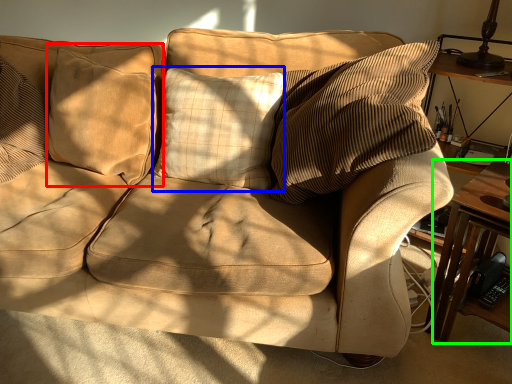
Question: Based on their relative distances, which object is farther from pillow (highlighted by a red box)? Choose from pillow (highlighted by a blue box) and table (highlighted by a green box).

Choices:
 (A) pillow
 (B) table

Answer: (B)